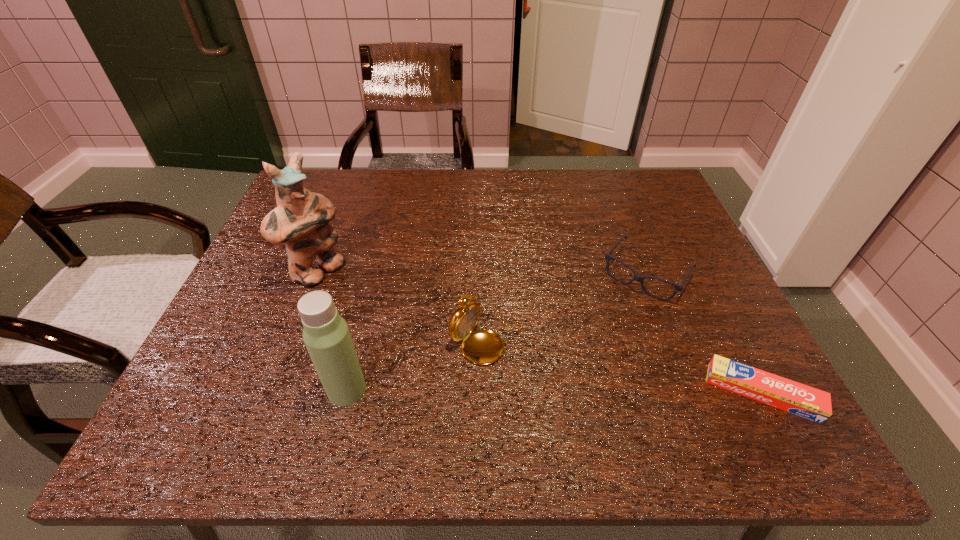
Locate an element on the screen. The width and height of the screenshot is (960, 540). vacant area situated on the front-facing side of the tallest object is located at coordinates (379, 315).

Find the location of a particular element. The width and height of the screenshot is (960, 540). vacant space located on the front-facing side of the tallest object is located at coordinates [402, 330].

The width and height of the screenshot is (960, 540). Find the location of `free region located 0.310m on the front-facing side of the tallest object`. free region located 0.310m on the front-facing side of the tallest object is located at coordinates (434, 351).

Find the location of a particular element. free region located on the face of the third object from right to left is located at coordinates (579, 395).

Where is `vacant space located on the face of the third object from right to left`? The width and height of the screenshot is (960, 540). vacant space located on the face of the third object from right to left is located at coordinates (535, 367).

Find the location of a particular element. vacant space located 0.200m on the front-facing side of the fourth tallest object is located at coordinates (587, 355).

Where is `vacant space located on the front-facing side of the fourth tallest object`? This screenshot has width=960, height=540. vacant space located on the front-facing side of the fourth tallest object is located at coordinates (578, 368).

This screenshot has width=960, height=540. What are the coordinates of `vacant space located 0.320m on the front-facing side of the fourth tallest object` in the screenshot? It's located at (557, 397).

Where is `thermos bottle that is at the near edge`? thermos bottle that is at the near edge is located at coordinates (326, 335).

This screenshot has width=960, height=540. Identify the location of toothpaste situated at the near edge. (779, 392).